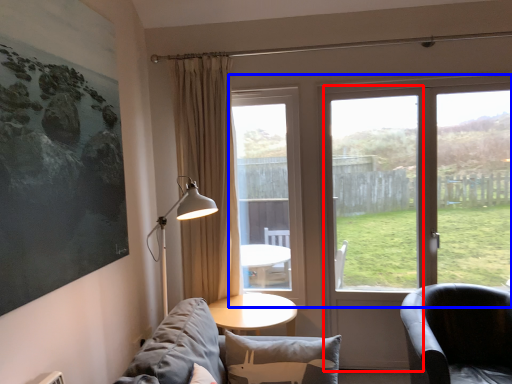
Question: Which object appears closest to the camera in this image, screen door (highlighted by a red box) or window (highlighted by a blue box)?

Choices:
 (A) screen door
 (B) window

Answer: (B)